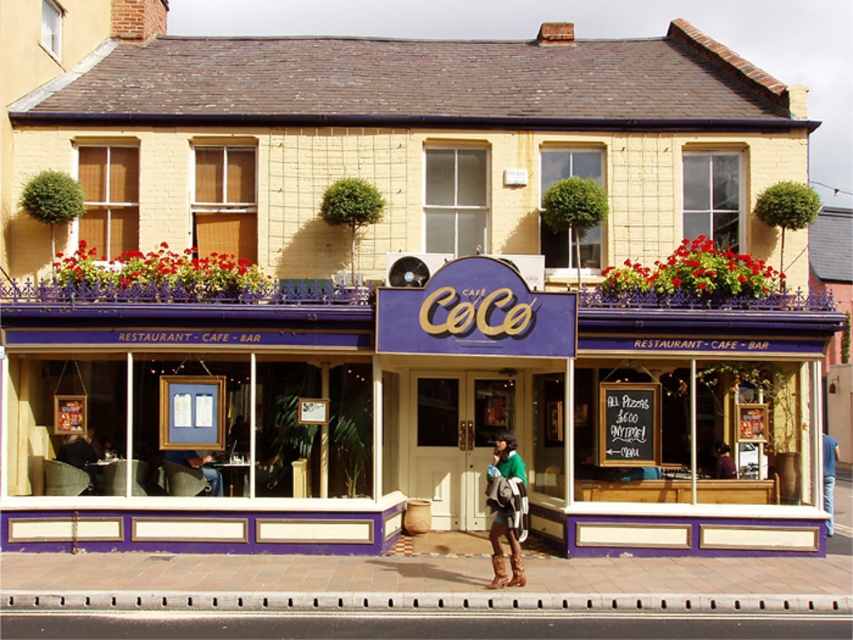
You are a customer entering the CoCo cafe and notice two green garments hanging on a rack near the entrance. The garments are a green knitted sweater at center and a green fabric jacket at center. Which garment is taller when hung?

The green knitted sweater at center is taller than the green fabric jacket at center when hung.

Looking at this image, what is the location of the point with coordinates (416, 602) in the image?

The point with coordinates (416, 602) is located on the metallic gray curb at lower center.

You are standing in front of the CoCo cafe and want to take a photo. There are two points on the building that you need to ensure are in focus. The first point is at coordinates point (230, 605) and the second is at point (505, 451). Which point should you focus on first to make sure both are sharp in the photo?

You should focus on point (230, 605) first because it is closer to the camera than point (505, 451). This way, adjusting the focus from near to far will help ensure both points are sharp.